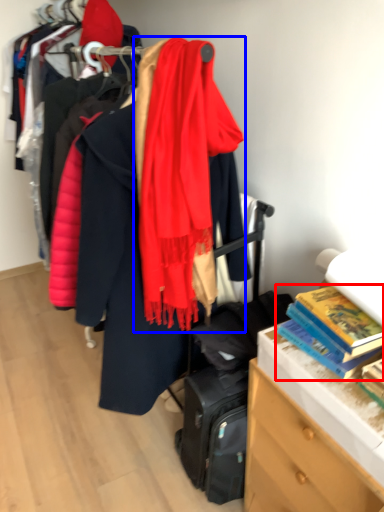
Question: Which of the following is the farthest to the observer, book (highlighted by a red box) or scarf (highlighted by a blue box)?

Choices:
 (A) book
 (B) scarf

Answer: (A)